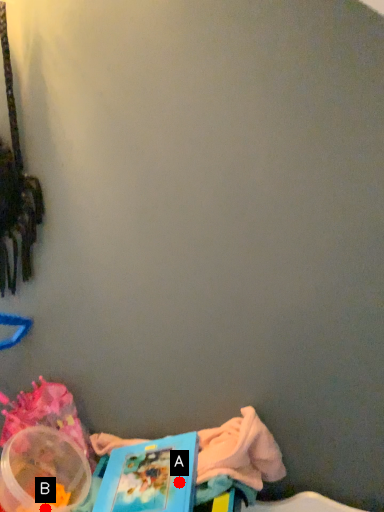
Question: Two points are circled on the image, labeled by A and B beside each circle. Which of the following is the closest to the observer?

Choices:
 (A) A is closer
 (B) B is closer

Answer: (A)